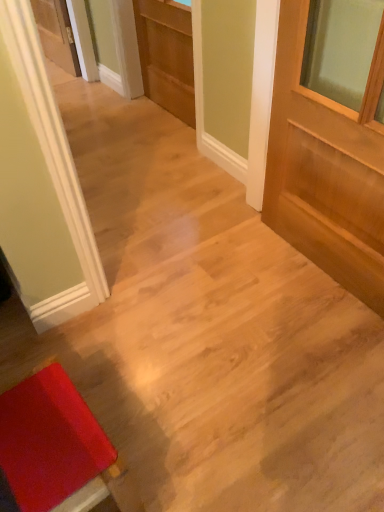
At what (x,y) coordinates should I click in order to perform the action: click on vacant space situated on the left part of light brown wood door at right, the first door when ordered from front to back. Please return your answer as a coordinate pair (x, y). This screenshot has width=384, height=512. Looking at the image, I should click on (230, 282).